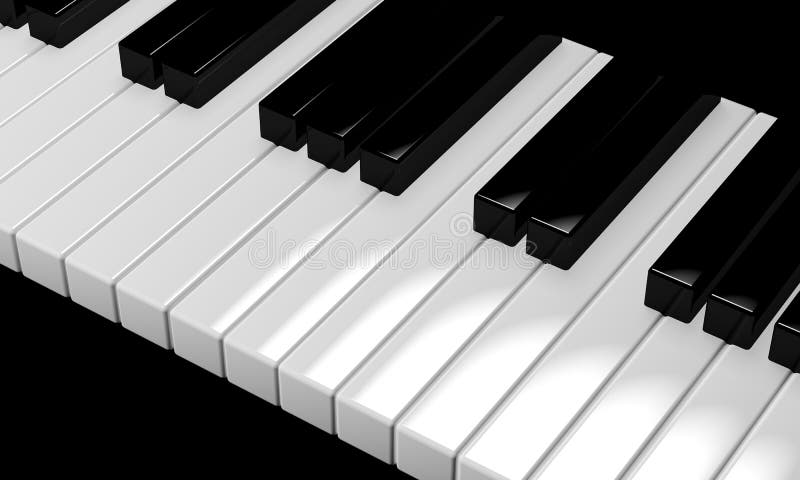
At what (x,y) coordinates should I click in order to perform the action: click on keyboard. Please return your answer as a coordinate pair (x, y). Looking at the image, I should click on (365, 265).